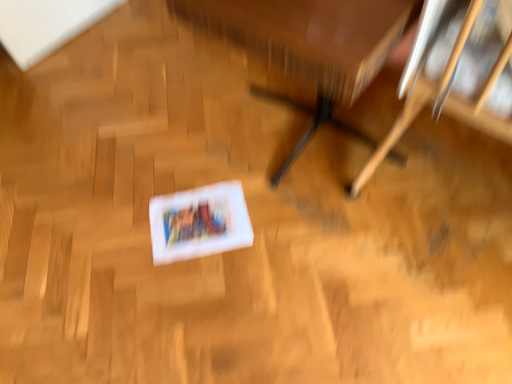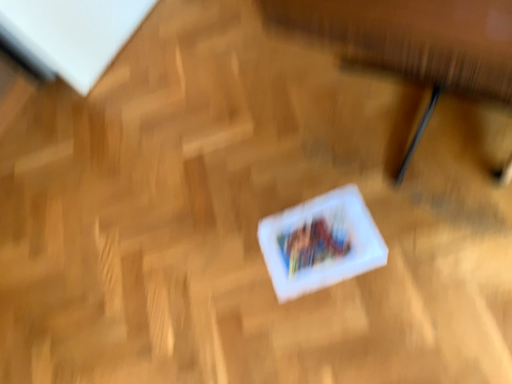
Question: How did the camera likely rotate when shooting the video?

Choices:
 (A) rotated upward
 (B) rotated downward

Answer: (B)